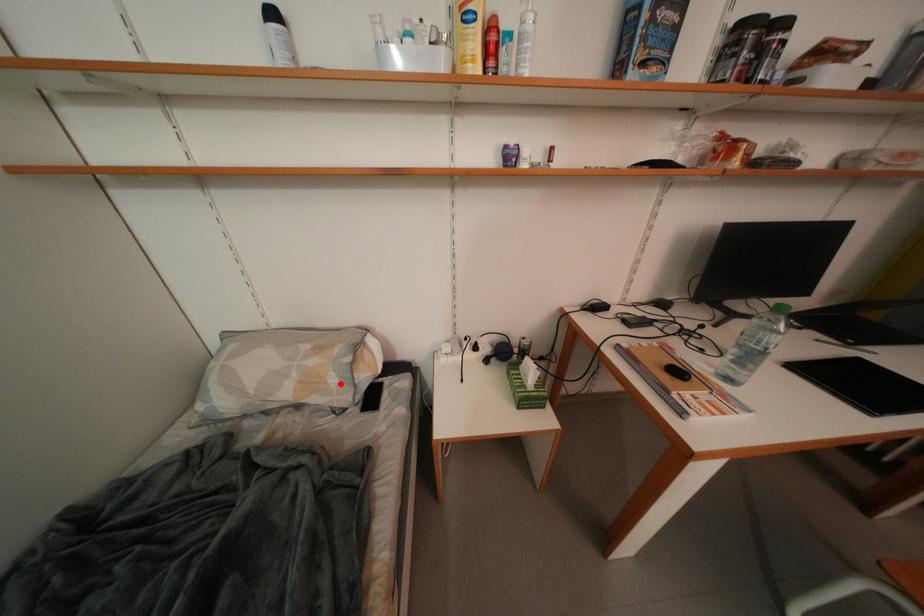
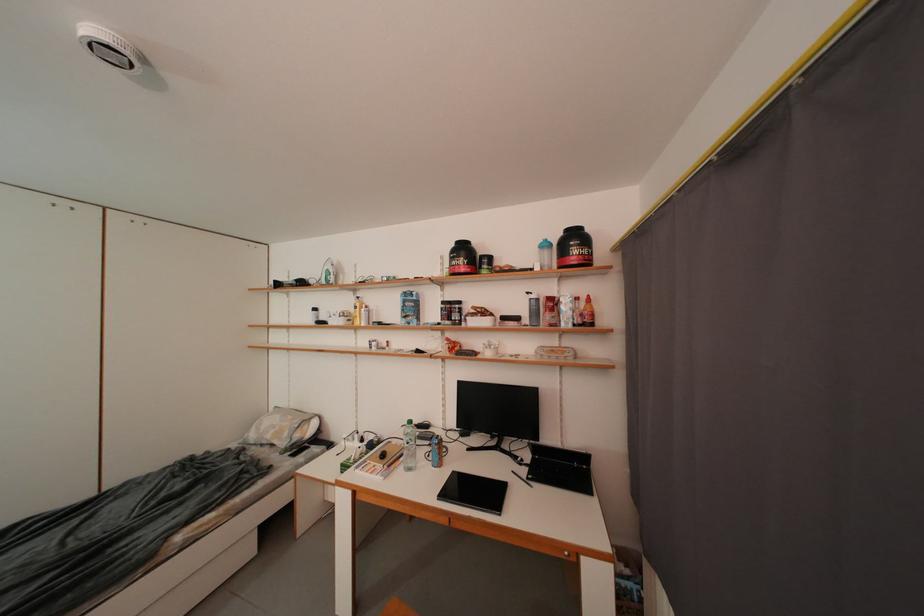
In the second image, find the point that corresponds to the highlighted location in the first image.

(294, 438)